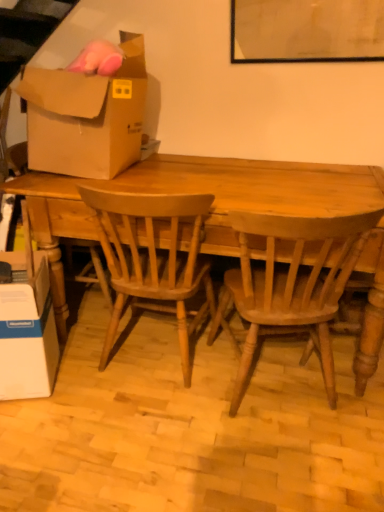
Question: Does white cardboard box at lower left, arranged as the 1th box when ordered from the bottom, touch brown cardboard box at upper left, placed as the 1th box when sorted from top to bottom?

Choices:
 (A) no
 (B) yes

Answer: (A)

Question: Considering the relative sizes of white cardboard box at lower left, positioned as the 2th box in top-to-bottom order, and brown cardboard box at upper left, placed as the 2th box when sorted from bottom to top, in the image provided, is white cardboard box at lower left, positioned as the 2th box in top-to-bottom order, smaller than brown cardboard box at upper left, placed as the 2th box when sorted from bottom to top,?

Choices:
 (A) yes
 (B) no

Answer: (A)

Question: Is white cardboard box at lower left, positioned as the 2th box in top-to-bottom order, not within brown cardboard box at upper left, placed as the 2th box when sorted from bottom to top?

Choices:
 (A) yes
 (B) no

Answer: (A)

Question: Is brown cardboard box at upper left, placed as the 2th box when sorted from bottom to top, at the back of white cardboard box at lower left, arranged as the 1th box when ordered from the bottom?

Choices:
 (A) yes
 (B) no

Answer: (B)

Question: From the image's perspective, would you say white cardboard box at lower left, positioned as the 2th box in top-to-bottom order, is positioned over brown cardboard box at upper left, placed as the 2th box when sorted from bottom to top?

Choices:
 (A) yes
 (B) no

Answer: (B)

Question: In the image, is light brown wood chair at center, acting as the first chair starting from the left, positioned in front of or behind light brown wood chair at center, the second chair when ordered from left to right?

Choices:
 (A) behind
 (B) front

Answer: (A)

Question: Is light brown wood chair at center, which is counted as the 2th chair, starting from the right, wider or thinner than light brown wood chair at center, the second chair when ordered from left to right?

Choices:
 (A) wide
 (B) thin

Answer: (A)

Question: Based on their sizes in the image, would you say light brown wood chair at center, which is counted as the 2th chair, starting from the right, is bigger or smaller than light brown wood chair at center, arranged as the 1th chair when viewed from the right?

Choices:
 (A) small
 (B) big

Answer: (A)

Question: Is light brown wood chair at center, which is counted as the 2th chair, starting from the right, to the left or to the right of light brown wood chair at center, the second chair when ordered from left to right, in the image?

Choices:
 (A) left
 (B) right

Answer: (A)

Question: From a real-world perspective, is white cardboard box at lower left, arranged as the 1th box when ordered from the bottom, above or below brown cardboard box at upper left, placed as the 1th box when sorted from top to bottom?

Choices:
 (A) above
 (B) below

Answer: (B)

Question: Do you think white cardboard box at lower left, positioned as the 2th box in top-to-bottom order, is within brown cardboard box at upper left, placed as the 1th box when sorted from top to bottom, or outside of it?

Choices:
 (A) outside
 (B) inside

Answer: (A)

Question: Does point (11, 271) appear closer or farther from the camera than point (74, 124)?

Choices:
 (A) closer
 (B) farther

Answer: (A)

Question: Is white cardboard box at lower left, arranged as the 1th box when ordered from the bottom, to the left or to the right of brown cardboard box at upper left, placed as the 1th box when sorted from top to bottom, in the image?

Choices:
 (A) left
 (B) right

Answer: (A)

Question: In the image, is light brown wood chair at center, arranged as the 1th chair when viewed from the right, positioned in front of or behind white cardboard box at lower left, positioned as the 2th box in top-to-bottom order?

Choices:
 (A) behind
 (B) front

Answer: (B)

Question: Based on their sizes in the image, would you say light brown wood chair at center, the second chair when ordered from left to right, is bigger or smaller than white cardboard box at lower left, arranged as the 1th box when ordered from the bottom?

Choices:
 (A) big
 (B) small

Answer: (A)